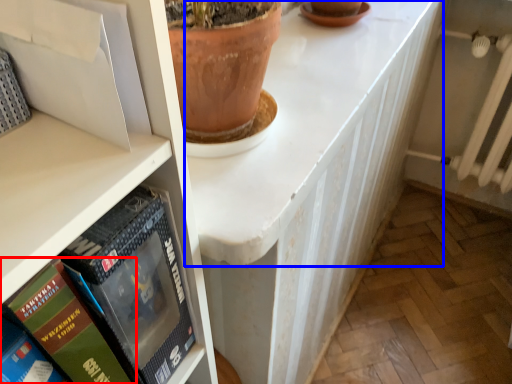
Question: Which object appears closest to the camera in this image, book (highlighted by a red box) or counter top (highlighted by a blue box)?

Choices:
 (A) book
 (B) counter top

Answer: (A)